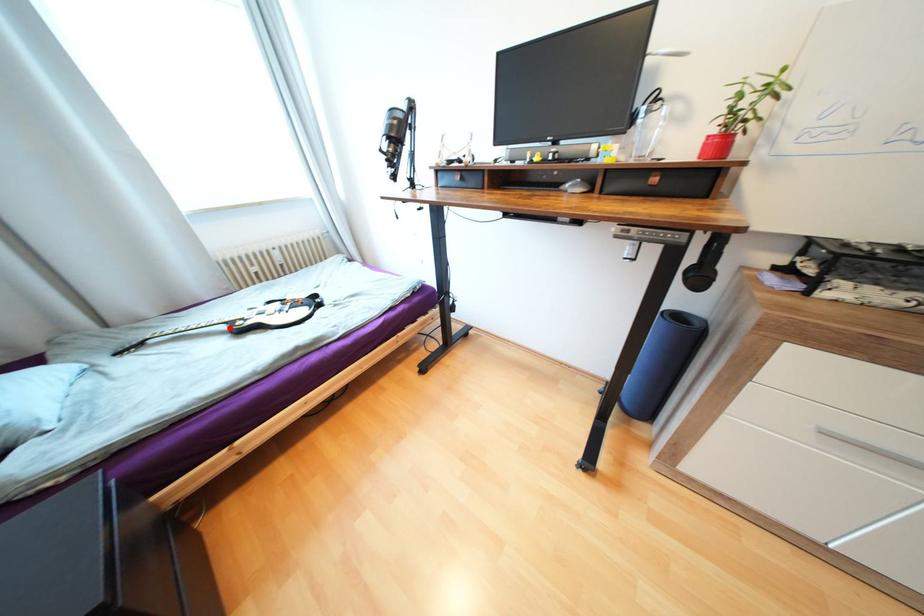
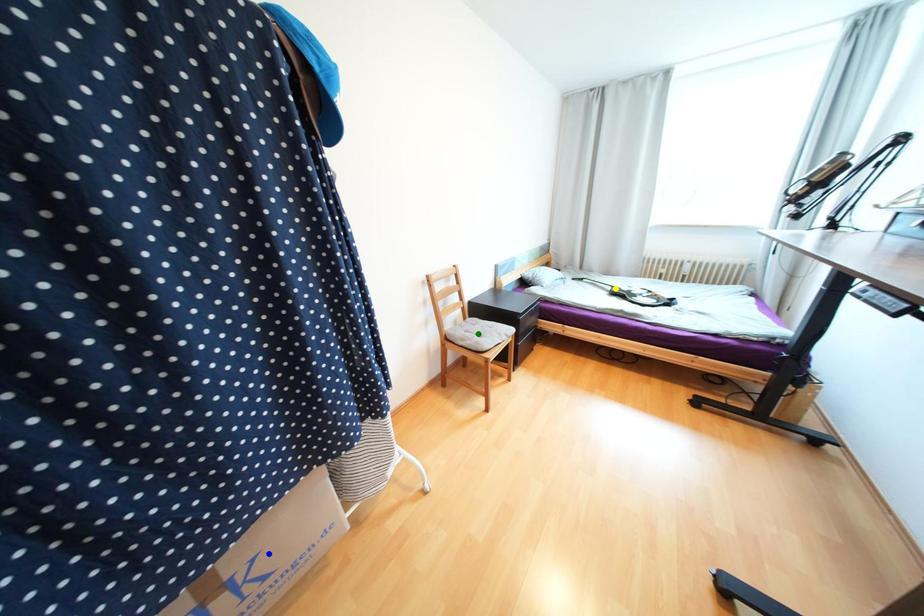
Question: I am providing you with two images of the same scene from different viewpoints. A red point is marked on the first image. You are given multiple points on the second image. Which spot in image 2 lines up with the point in image 1?

Choices:
 (A) yellow point
 (B) blue point
 (C) green point

Answer: (A)